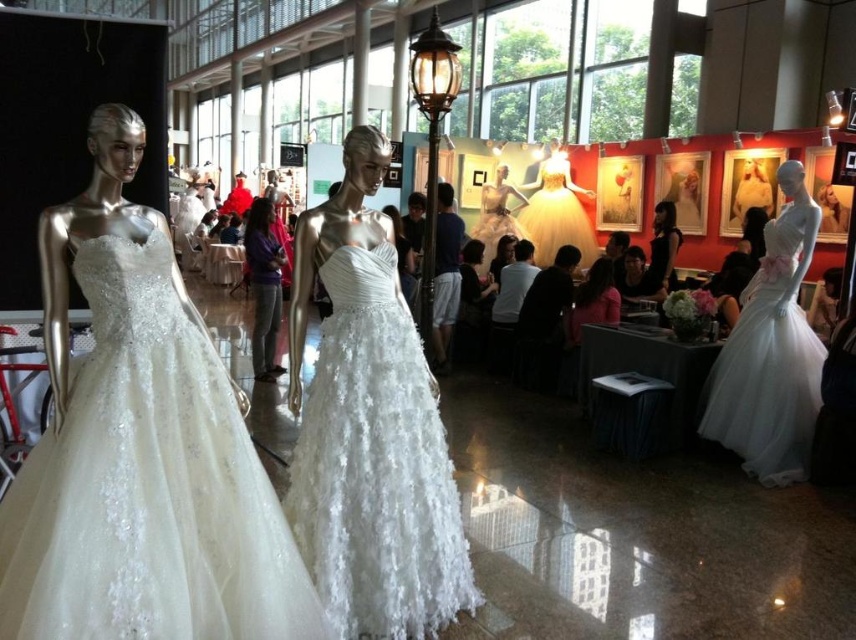
Between white tulle dress at right and matte silver mannequin at center, which one is positioned higher?

matte silver mannequin at center is higher up.

Based on the photo, is white tulle dress at right above matte silver mannequin at center?

Incorrect, white tulle dress at right is not positioned above matte silver mannequin at center.

Does point (770, 428) come closer to viewer compared to point (518, 198)?

Yes, point (770, 428) is closer to viewer.

You are a GUI agent. You are given a task and a screenshot of the screen. Output one action in this format:
    pyautogui.click(x=<x>, y=<y>)
    Task: Click on the white tulle dress at right
    
    Given the screenshot: What is the action you would take?
    (x=770, y=355)

Consider the image. Does matte white gown at center appear over matte silver mannequin at center?

Correct, matte white gown at center is located above matte silver mannequin at center.

Which is above, matte white gown at center or matte silver mannequin at center?

matte white gown at center is above.

Identify the location of matte white gown at center. (556, 211).

Locate an element on the screen. This screenshot has height=640, width=856. white textured gown at center is located at coordinates (376, 465).